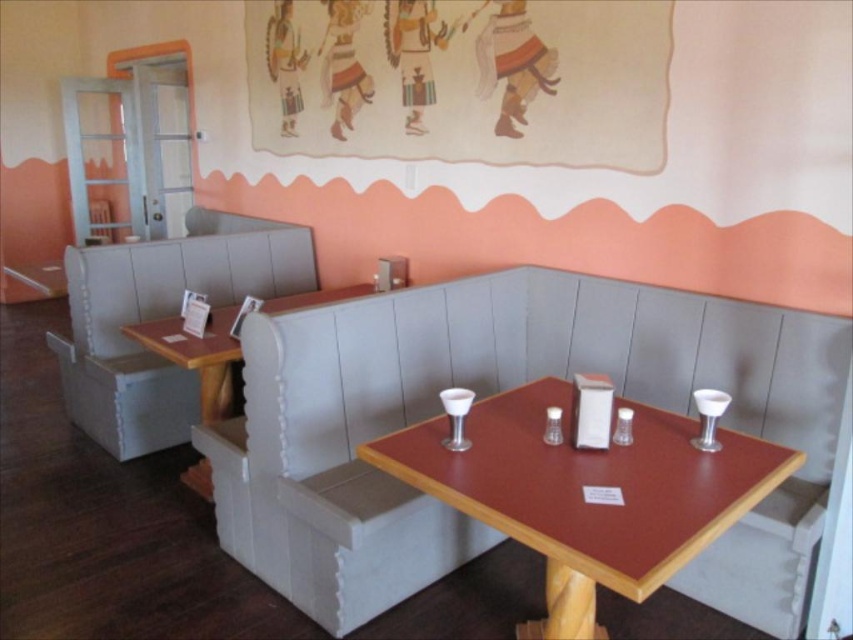
You are a customer sitting at a booth in the restaurant and want to take a photo of both the point at location (326, 593) and the point at location (584, 515). Which point should you focus on first to ensure both are in the frame?

You should focus on the point at location (326, 593) first because it is closer to you than the point at location (584, 515), ensuring both points remain in the frame.

You are a customer entering the restaurant and want to choose seating. You see a white fabric chair at center and a white fabric booth at left. Which one offers more seating space?

The white fabric chair at center has a larger size compared to the white fabric booth at left, so it offers more seating space.

You are a restaurant manager checking the seating arrangement. You need to seat a large group of 6 guests. The white fabric chair at center and wooden table at center are in the way. Can you move the smaller one to make space?

The wooden table at center is smaller than the white fabric chair at center. Since the wooden table at center is smaller, you can move it to make space for the large group of 6 guests.